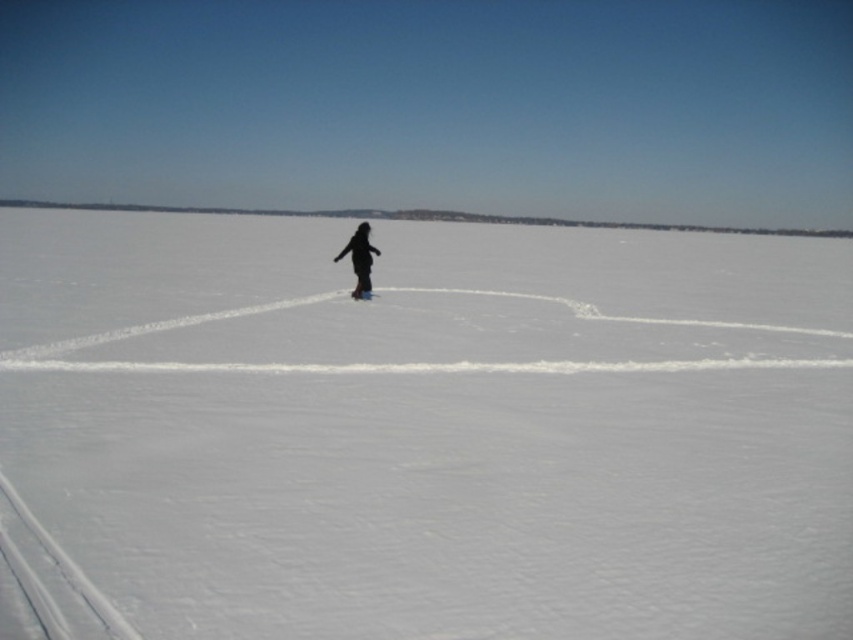
Question: Which object is farther from the camera taking this photo?

Choices:
 (A) black matte snowboarder at center
 (B) white matte snowboard at center
 (C) white smooth snow at center

Answer: (B)

Question: Can you confirm if white smooth snow at center is smaller than white matte snowboard at center?

Choices:
 (A) no
 (B) yes

Answer: (A)

Question: Which point is closer to the camera?

Choices:
 (A) (492, 284)
 (B) (360, 228)

Answer: (B)

Question: Is black matte snowboarder at center above white matte snowboard at center?

Choices:
 (A) no
 (B) yes

Answer: (B)

Question: In this image, where is white smooth snow at center located relative to black matte snowboarder at center?

Choices:
 (A) below
 (B) above

Answer: (B)

Question: Which point is closer to the camera taking this photo?

Choices:
 (A) (360, 289)
 (B) (175, 337)
 (C) (361, 260)

Answer: (B)